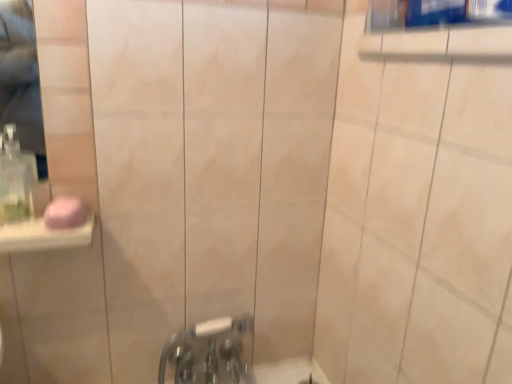
Question: Is chrome metallic faucet at lower center aimed at pink matte soap at left?

Choices:
 (A) no
 (B) yes

Answer: (A)

Question: Does chrome metallic faucet at lower center have a lesser height compared to pink matte soap at left?

Choices:
 (A) yes
 (B) no

Answer: (B)

Question: From the image's perspective, does chrome metallic faucet at lower center appear lower than pink matte soap at left?

Choices:
 (A) yes
 (B) no

Answer: (A)

Question: From the image's perspective, is chrome metallic faucet at lower center on pink matte soap at left?

Choices:
 (A) no
 (B) yes

Answer: (A)

Question: Can you confirm if chrome metallic faucet at lower center is smaller than pink matte soap at left?

Choices:
 (A) no
 (B) yes

Answer: (A)

Question: Is chrome metallic faucet at lower center to the right of pink matte soap at left from the viewer's perspective?

Choices:
 (A) yes
 (B) no

Answer: (A)

Question: From a real-world perspective, is pink matte soap at left physically above clear plastic soap dispenser at left?

Choices:
 (A) yes
 (B) no

Answer: (B)

Question: Can you confirm if pink matte soap at left is positioned to the left of clear plastic soap dispenser at left?

Choices:
 (A) yes
 (B) no

Answer: (B)

Question: Are pink matte soap at left and clear plastic soap dispenser at left making contact?

Choices:
 (A) yes
 (B) no

Answer: (B)

Question: From the image's perspective, is pink matte soap at left located beneath clear plastic soap dispenser at left?

Choices:
 (A) yes
 (B) no

Answer: (A)

Question: From the image's perspective, is pink matte soap at left over clear plastic soap dispenser at left?

Choices:
 (A) yes
 (B) no

Answer: (B)

Question: Is pink matte soap at left to the right of clear plastic soap dispenser at left from the viewer's perspective?

Choices:
 (A) no
 (B) yes

Answer: (B)

Question: Does chrome metallic faucet at lower center have a greater height compared to clear plastic soap dispenser at left?

Choices:
 (A) yes
 (B) no

Answer: (A)